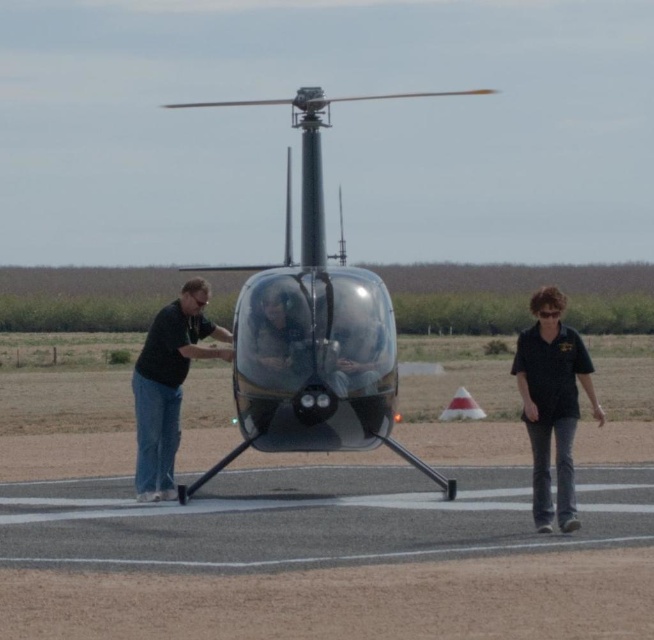
Who is shorter, smooth asphalt tarmac at center or black matte shirt at center?

smooth asphalt tarmac at center is shorter.

Is point (521, 628) more distant than point (521, 397)?

That is False.

Locate an element on the screen. Image resolution: width=654 pixels, height=640 pixels. smooth asphalt tarmac at center is located at coordinates (328, 557).

Which is above, glossy metallic helicopter at center or black matte shirt at center?

glossy metallic helicopter at center is above.

Can you confirm if glossy metallic helicopter at center is smaller than black matte shirt at center?

Incorrect, glossy metallic helicopter at center is not smaller in size than black matte shirt at center.

Between point (309, 147) and point (545, 492), which one is positioned behind?

The point (309, 147) is behind.

The height and width of the screenshot is (640, 654). What are the coordinates of `glossy metallic helicopter at center` in the screenshot? It's located at (311, 326).

Which is more to the left, smooth asphalt tarmac at center or glossy metallic helicopter at center?

glossy metallic helicopter at center

Consider the image. Does smooth asphalt tarmac at center have a smaller size compared to glossy metallic helicopter at center?

Correct, smooth asphalt tarmac at center occupies less space than glossy metallic helicopter at center.

Is point (122, 540) positioned behind point (237, 321)?

No.

Locate an element on the screen. This screenshot has width=654, height=640. smooth asphalt tarmac at center is located at coordinates (328, 557).